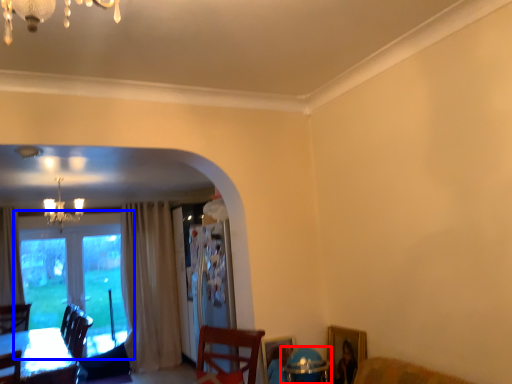
Question: Which object is further to the camera taking this photo, round table (highlighted by a red box) or window (highlighted by a blue box)?

Choices:
 (A) round table
 (B) window

Answer: (B)